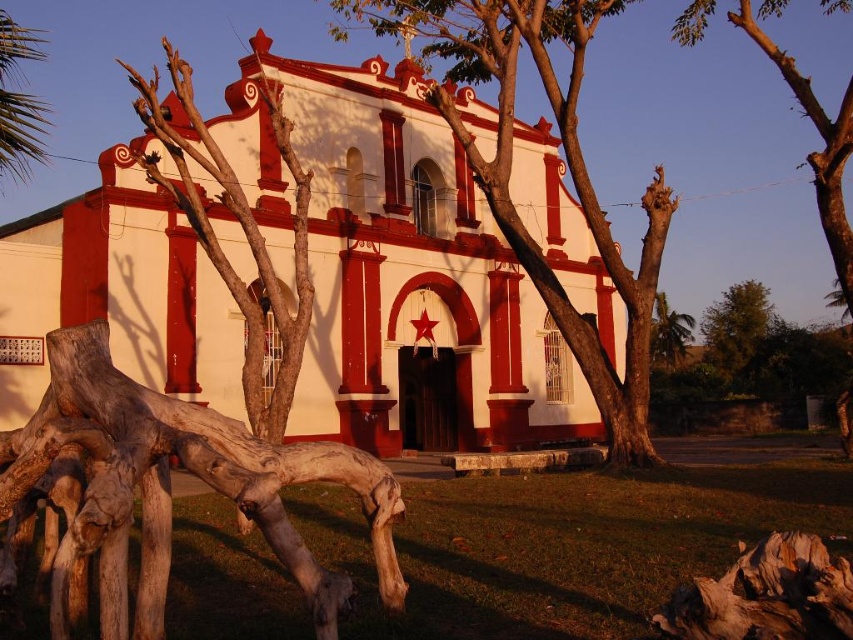
Question: From the image, what is the correct spatial relationship of green leafy palm at upper left in relation to green leafy tree at right?

Choices:
 (A) below
 (B) above

Answer: (B)

Question: Which object is positioned farthest from the white painted stucco church at center?

Choices:
 (A) smooth bark tree at center
 (B) green leafy palm tree at center
 (C) green leafy tree at right

Answer: (C)

Question: Is smooth bark tree at center in front of green leafy tree at right?

Choices:
 (A) no
 (B) yes

Answer: (B)

Question: Among these objects, which one is nearest to the camera?

Choices:
 (A) green leafy tree at right
 (B) green leafy palm tree at center

Answer: (B)

Question: Which point is closer to the camera taking this photo?

Choices:
 (A) [x=6, y=113]
 (B) [x=674, y=314]
 (C) [x=93, y=220]
 (D) [x=712, y=355]

Answer: (A)

Question: Does white painted stucco church at center appear on the right side of green leafy palm tree at center?

Choices:
 (A) yes
 (B) no

Answer: (B)